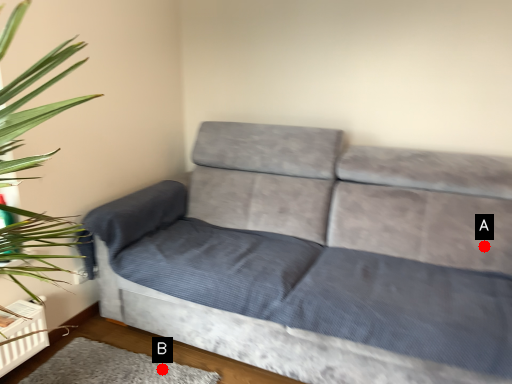
Question: Two points are circled on the image, labeled by A and B beside each circle. Which point is further to the camera?

Choices:
 (A) A is further
 (B) B is further

Answer: (A)